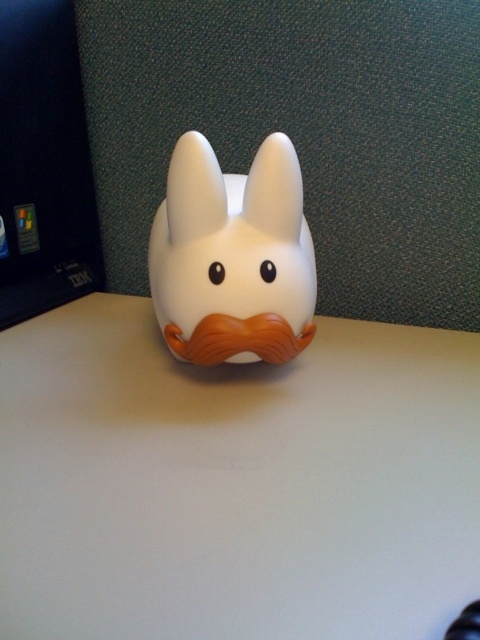
You are setting up a workspace and need to place both the white matte table at center and the black plastic laptop at left. Given their sizes, which object should you prioritize placing first to ensure they both fit properly?

The white matte table at center is wider than the black plastic laptop at left. Since the table is larger, you should prioritize placing the white matte table at center first to ensure there is enough space for the laptop afterward.

You are looking at the white ceramic bunny figurine on the table. There are two points marked on it, one at coordinates point (x=357, y=369) and the other at point (x=168, y=304). Which point is closer to you as you observe the figurine?

Point (x=357, y=369) is closer to the viewer than point (x=168, y=304) because it is further to the viewer according to the description.